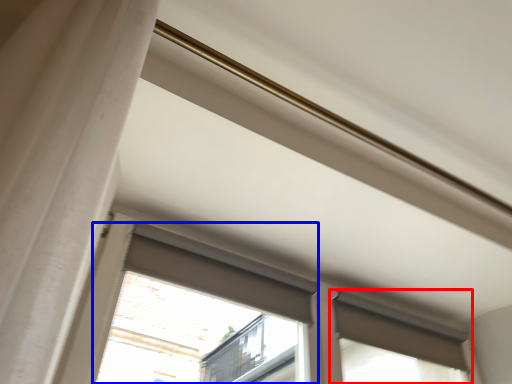
Question: Among these objects, which one is farthest to the camera, window (highlighted by a red box) or bay window (highlighted by a blue box)?

Choices:
 (A) window
 (B) bay window

Answer: (A)